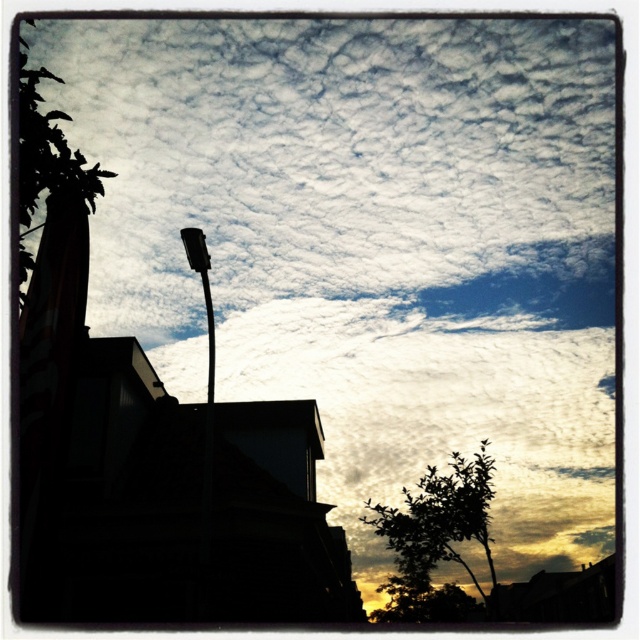
Does green leafy tree at upper left have a greater width compared to black glossy streetlight at upper center?

Yes, green leafy tree at upper left is wider than black glossy streetlight at upper center.

Measure the distance between green leafy tree at upper left and black glossy streetlight at upper center.

green leafy tree at upper left is 2.96 meters from black glossy streetlight at upper center.

Describe the element at coordinates (45, 160) in the screenshot. I see `green leafy tree at upper left` at that location.

You are a GUI agent. You are given a task and a screenshot of the screen. Output one action in this format:
    pyautogui.click(x=<x>, y=<y>)
    Task: Click on the green leafy tree at upper left
    
    Given the screenshot: What is the action you would take?
    pyautogui.click(x=45, y=160)

Is silhouette leafy tree at lower right closer to the viewer compared to black glossy streetlight at upper center?

That is False.

Could you measure the distance between silhouette leafy tree at lower right and black glossy streetlight at upper center?

silhouette leafy tree at lower right and black glossy streetlight at upper center are 21.85 meters apart from each other.

Identify the location of silhouette leafy tree at lower right. (436, 541).

I want to click on silhouette leafy tree at lower right, so click(436, 541).

Who is positioned more to the left, silhouette leafy tree at lower right or green leafy tree at upper left?

From the viewer's perspective, green leafy tree at upper left appears more on the left side.

Which is below, silhouette leafy tree at lower right or green leafy tree at upper left?

silhouette leafy tree at lower right

Locate an element on the screen. silhouette leafy tree at lower right is located at coordinates (436, 541).

Where is `silhouette leafy tree at lower right`? The width and height of the screenshot is (640, 640). silhouette leafy tree at lower right is located at coordinates pyautogui.click(x=436, y=541).